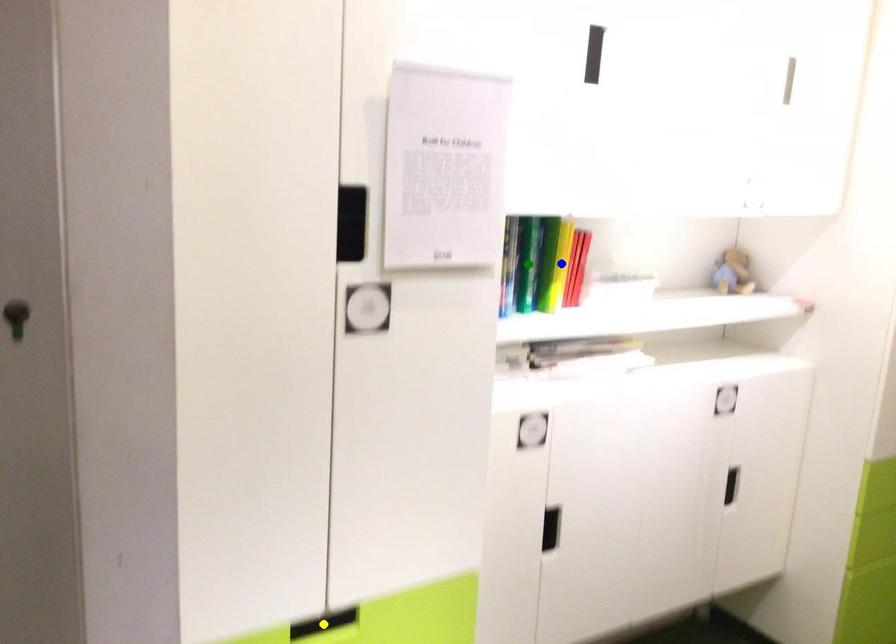
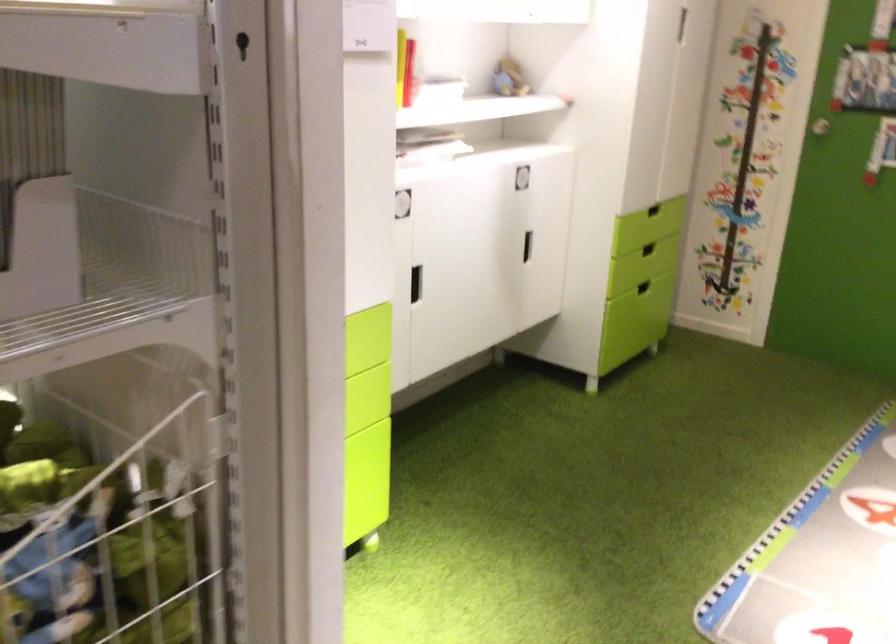
I am providing you with two images of the same scene from different viewpoints. Three points are marked in image1. Which point corresponds to a part or object that is occluded in image2?In image1, three points are marked. Which of them correspond to a part or object that is occluded in image2?Among the three points shown in image1, which one corresponds to a part or object that is no longer visible due to occlusion in image2?

yellow point, blue point, green point